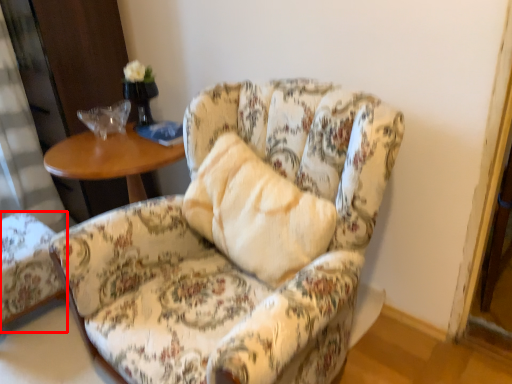
Question: Observing the image, what is the correct spatial positioning of chair (annotated by the red box) in reference to chair?

Choices:
 (A) right
 (B) left

Answer: (B)